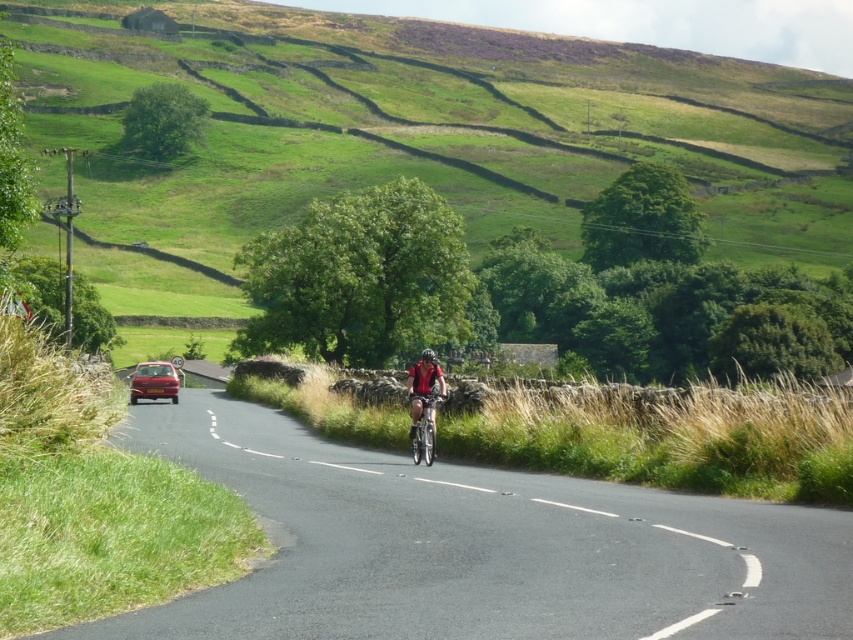
Question: Is metallic silver bicycle at center closer to the viewer compared to black matte helmet at center?

Choices:
 (A) yes
 (B) no

Answer: (A)

Question: Which is farther from the metallic red car at left?

Choices:
 (A) black asphalt road at center
 (B) red fabric cyclist at center

Answer: (A)

Question: Considering the relative positions of metallic red car at left and metallic silver bicycle at center in the image provided, where is metallic red car at left located with respect to metallic silver bicycle at center?

Choices:
 (A) below
 (B) above

Answer: (A)

Question: Which point is closer to the camera?

Choices:
 (A) red fabric cyclist at center
 (B) metallic silver bicycle at center

Answer: (B)

Question: Does red fabric cyclist at center appear on the left side of metallic silver bicycle at center?

Choices:
 (A) no
 (B) yes

Answer: (B)

Question: Which of these objects is positioned farthest from the metallic silver bicycle at center?

Choices:
 (A) black asphalt road at center
 (B) metallic red car at left

Answer: (B)